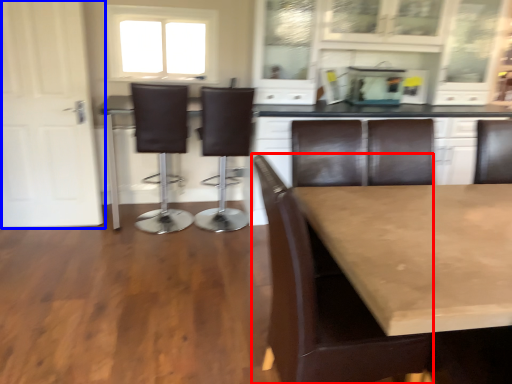
Question: Which object is further to the camera taking this photo, chair (highlighted by a red box) or door (highlighted by a blue box)?

Choices:
 (A) chair
 (B) door

Answer: (B)